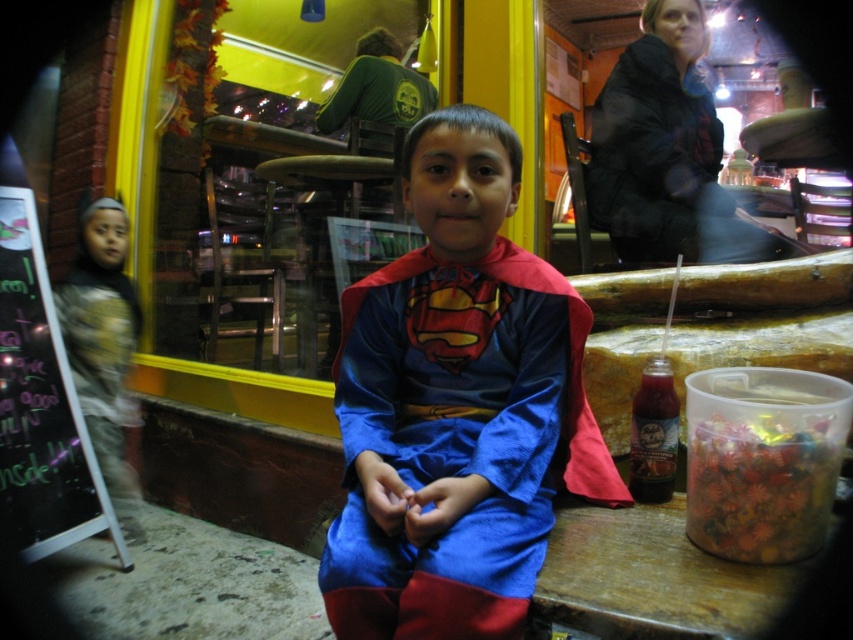
Question: Which object is positioned closest to the black fuzzy robe at upper right?

Choices:
 (A) velvet blue cape at center
 (B) translucent plastic container at lower right

Answer: (A)

Question: In this image, where is velvet blue cape at center located relative to wooden table at lower right?

Choices:
 (A) right
 (B) left

Answer: (B)

Question: Is velvet blue cape at center bigger than black fuzzy robe at upper right?

Choices:
 (A) yes
 (B) no

Answer: (A)

Question: Which of the following is the farthest from the observer?

Choices:
 (A) (668, 138)
 (B) (555, 602)
 (C) (796, 445)

Answer: (A)

Question: Can you confirm if velvet blue cape at center is positioned below translucent plastic container at lower right?

Choices:
 (A) no
 (B) yes

Answer: (A)

Question: Among these points, which one is farthest from the camera?

Choices:
 (A) (747, 516)
 (B) (677, 604)

Answer: (A)